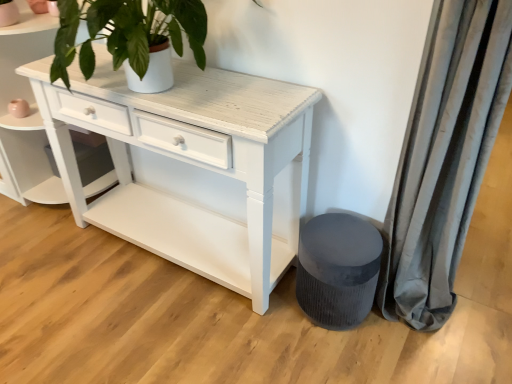
Identify the location of free space in front of white distressed wood shelf at center. This screenshot has width=512, height=384. (59, 250).